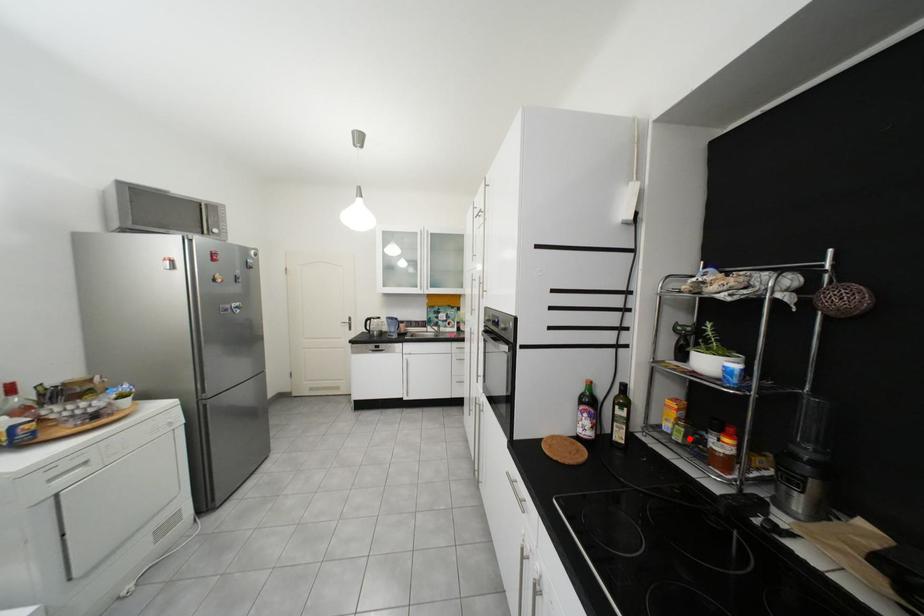
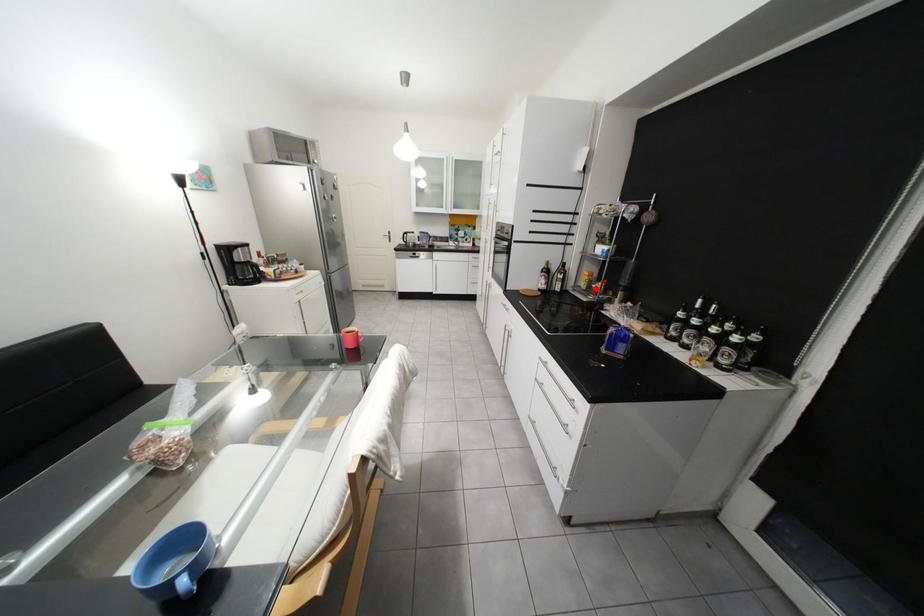
I am providing you with two images of the same scene from different viewpoints. A red point is marked on the first image and another point is marked on the second image. Do the highlighted points in image1 and image2 indicate the same real-world spot?

Yes